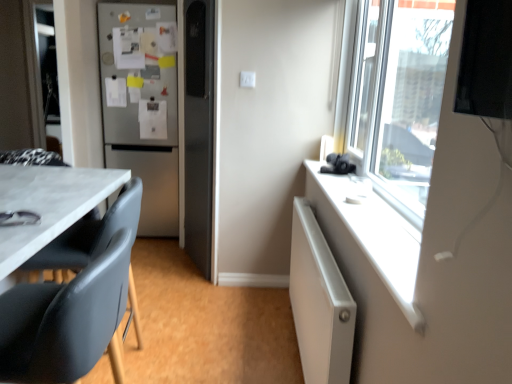
Question: Considering the positions of white textured radiator at right and white plastic window sill at upper right in the image, is white textured radiator at right bigger or smaller than white plastic window sill at upper right?

Choices:
 (A) big
 (B) small

Answer: (A)

Question: Visually, is white textured radiator at right positioned to the left or to the right of white plastic window sill at upper right?

Choices:
 (A) right
 (B) left

Answer: (B)

Question: Which is farther from the white plastic window sill at upper right?

Choices:
 (A) white textured radiator at right
 (B) black leather chair at lower left
 (C) black plastic swivel chair at left
 (D) satin silver refrigerator at left
 (E) white plastic electric outlet at center

Answer: (D)

Question: Which object is positioned farthest from the black leather chair at lower left?

Choices:
 (A) white plastic electric outlet at center
 (B) black plastic swivel chair at left
 (C) satin silver refrigerator at left
 (D) white textured radiator at right
 (E) white plastic window sill at upper right

Answer: (C)